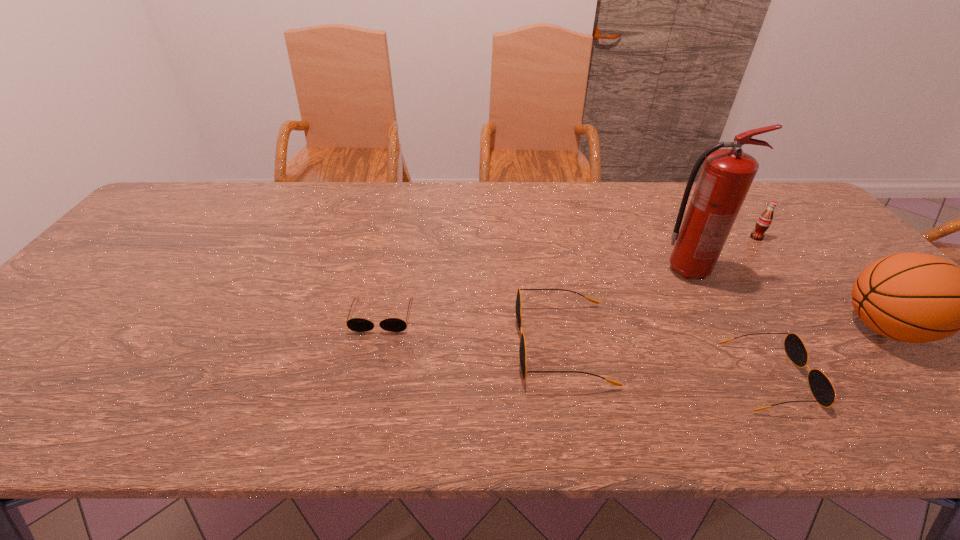
This screenshot has width=960, height=540. In order to click on the second closest sunglasses to the third tallest object in this screenshot , I will do `click(522, 348)`.

Locate which sunglasses is the second closest to the second shortest object. Please provide its 2D coordinates. Your answer should be formatted as a tuple, i.e. [(x, y)], where the tuple contains the x and y coordinates of a point satisfying the conditions above.

[(354, 324)]

Locate an element on the screen. Image resolution: width=960 pixels, height=540 pixels. vacant region that satisfies the following two spatial constraints: 1. on the front side of the farthest object; 2. on the front-facing side of the rightmost sunglasses is located at coordinates (864, 377).

Identify the location of vacant space that satisfies the following two spatial constraints: 1. on the handle side the second farthest object; 2. on the left side of the basketball. This screenshot has height=540, width=960. (717, 328).

Where is `vacant space that satisfies the following two spatial constraints: 1. on the handle side the tallest object; 2. on the front-facing side of the shortest sunglasses`? The image size is (960, 540). vacant space that satisfies the following two spatial constraints: 1. on the handle side the tallest object; 2. on the front-facing side of the shortest sunglasses is located at coordinates (710, 315).

The width and height of the screenshot is (960, 540). Find the location of `free point that satisfies the following two spatial constraints: 1. on the front side of the second tallest object; 2. on the front-facing side of the rightmost sunglasses`. free point that satisfies the following two spatial constraints: 1. on the front side of the second tallest object; 2. on the front-facing side of the rightmost sunglasses is located at coordinates (928, 377).

Identify the location of vacant area in the image that satisfies the following two spatial constraints: 1. on the handle side the fifth nearest object; 2. on the front-facing side of the leftmost sunglasses. (710, 315).